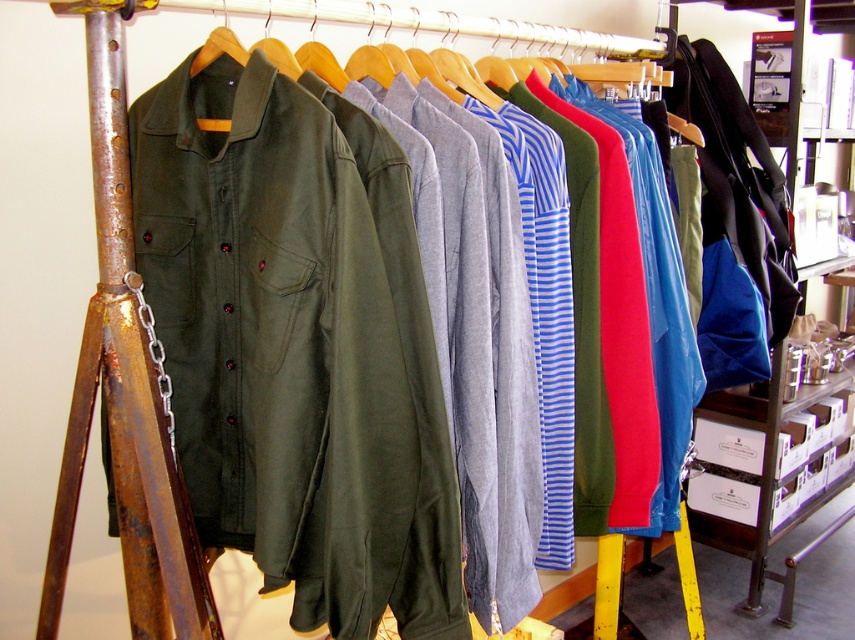
Which is below, olive green cotton jacket at left or rusty metal ladder at left?

olive green cotton jacket at left

From the picture: Is olive green cotton jacket at left to the right of rusty metal ladder at left from the viewer's perspective?

Indeed, olive green cotton jacket at left is positioned on the right side of rusty metal ladder at left.

The width and height of the screenshot is (855, 640). What do you see at coordinates (298, 344) in the screenshot?
I see `olive green cotton jacket at left` at bounding box center [298, 344].

Identify the location of olive green cotton jacket at left. The image size is (855, 640). (298, 344).